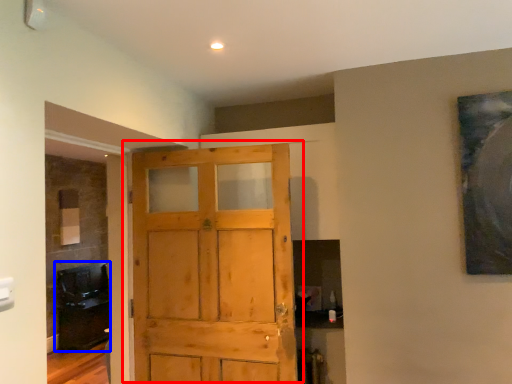
Question: Among these objects, which one is farthest to the camera, door (highlighted by a red box) or cabinetry (highlighted by a blue box)?

Choices:
 (A) door
 (B) cabinetry

Answer: (B)